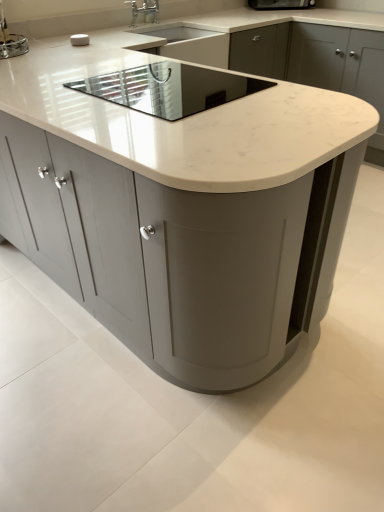
Question: In terms of width, does white marble countertop at center look wider or thinner when compared to white marble countertop at center?

Choices:
 (A) wide
 (B) thin

Answer: (A)

Question: Is white marble countertop at center to the left or to the right of white marble countertop at center in the image?

Choices:
 (A) left
 (B) right

Answer: (A)

Question: Which is farther from the white marble countertop at center?

Choices:
 (A) satin nickel faucet at upper center
 (B) chrome metallic faucet at upper center
 (C) metallic silver toaster at upper left, marked as the 1th appliance in a top-to-bottom arrangement
 (D) white marble countertop at center
 (E) black glass cooktop at center, the 1th appliance in the front-to-back sequence

Answer: (D)

Question: Which of these objects is positioned farthest from the chrome metallic faucet at upper center?

Choices:
 (A) white marble countertop at center
 (B) white marble countertop at center
 (C) satin nickel faucet at upper center
 (D) black glass cooktop at center, acting as the second appliance starting from the back
 (E) metallic silver toaster at upper left, the first appliance viewed from the left

Answer: (B)